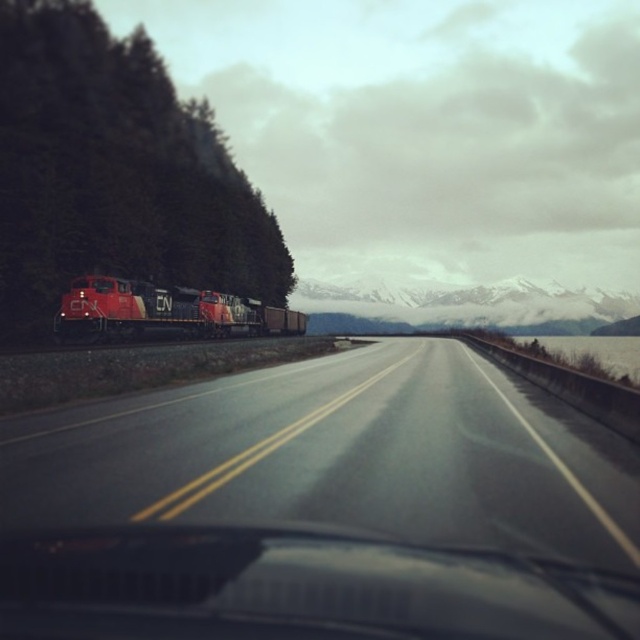
Question: Which is nearer to the black asphalt highway at center?

Choices:
 (A) snowy mountain at upper center
 (B) green matte tree at left

Answer: (B)

Question: Does transparent glass windshield at center come behind matte red train at left?

Choices:
 (A) yes
 (B) no

Answer: (B)

Question: Which point is farther to the camera?

Choices:
 (A) transparent glass windshield at center
 (B) matte red train at left

Answer: (B)

Question: Is transparent glass windshield at center smaller than matte red train at left?

Choices:
 (A) no
 (B) yes

Answer: (B)

Question: Estimate the real-world distances between objects in this image. Which object is closer to the matte red train at left?

Choices:
 (A) green matte tree at left
 (B) black asphalt highway at center

Answer: (A)

Question: Does snowy mountain at upper center appear over matte red train at left?

Choices:
 (A) yes
 (B) no

Answer: (A)